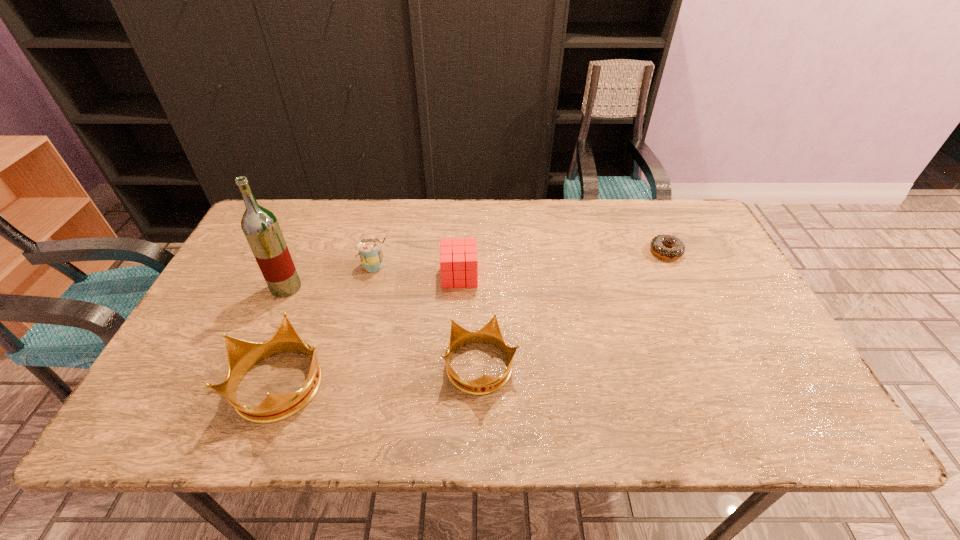
Please show where to add a crown on the right while keeping spacing even. Please provide its 2D coordinates. Your answer should be formatted as a tuple, i.e. [(x, y)], where the tuple contains the x and y coordinates of a point satisfying the conditions above.

[(670, 354)]